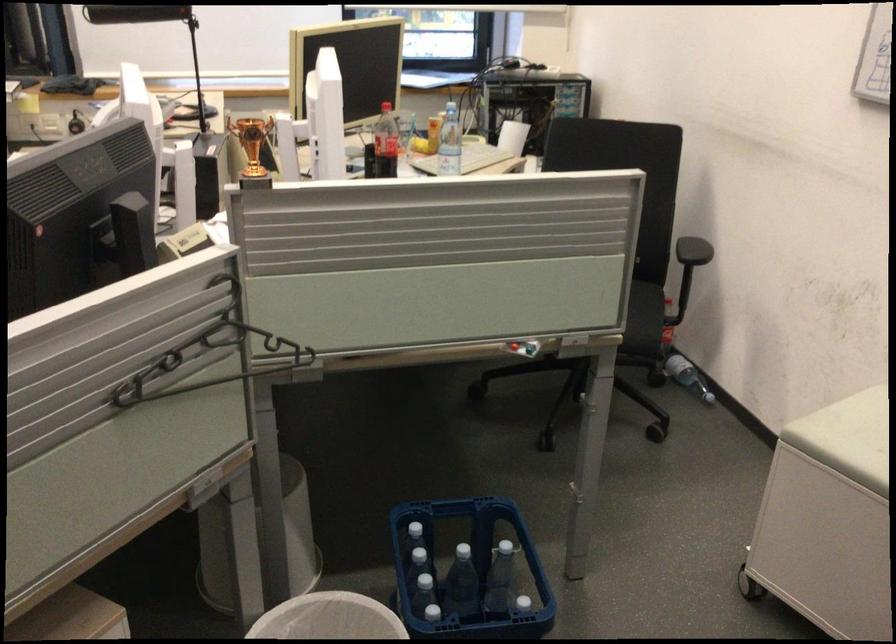
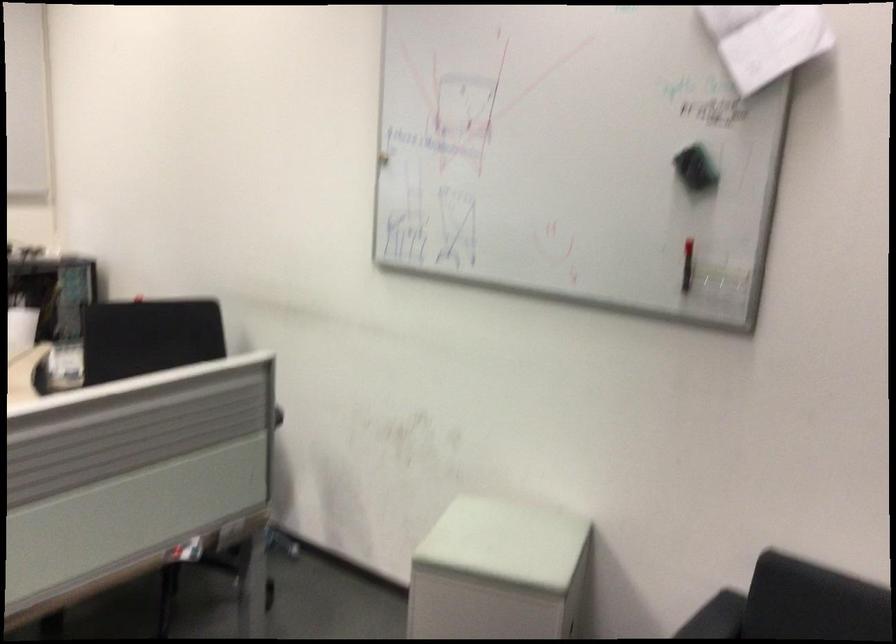
Question: The camera is either moving clockwise (left) or counter-clockwise (right) around the object. The first image is from the beginning of the video and the second image is from the end. Is the camera moving left or right when shooting the video?

Choices:
 (A) Left
 (B) Right

Answer: (A)